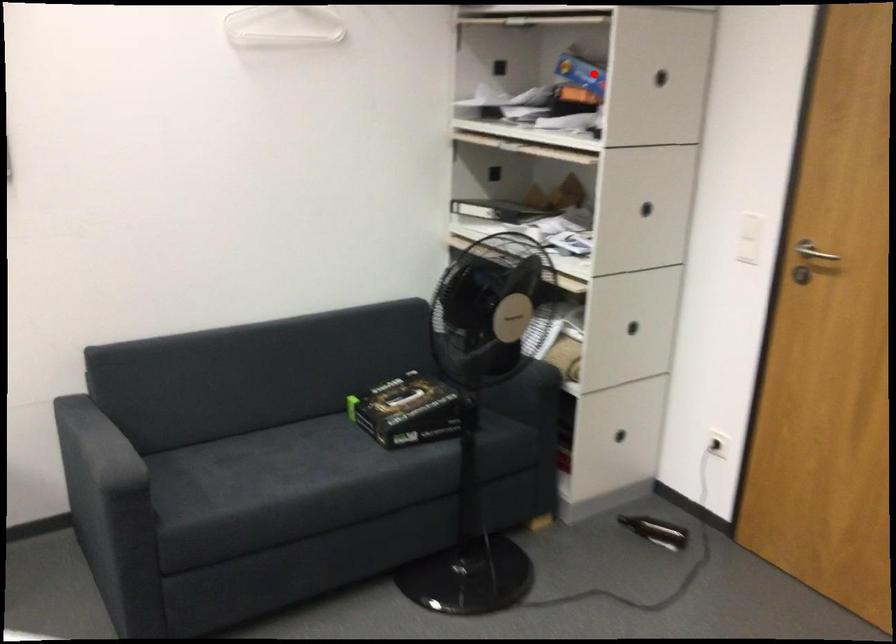
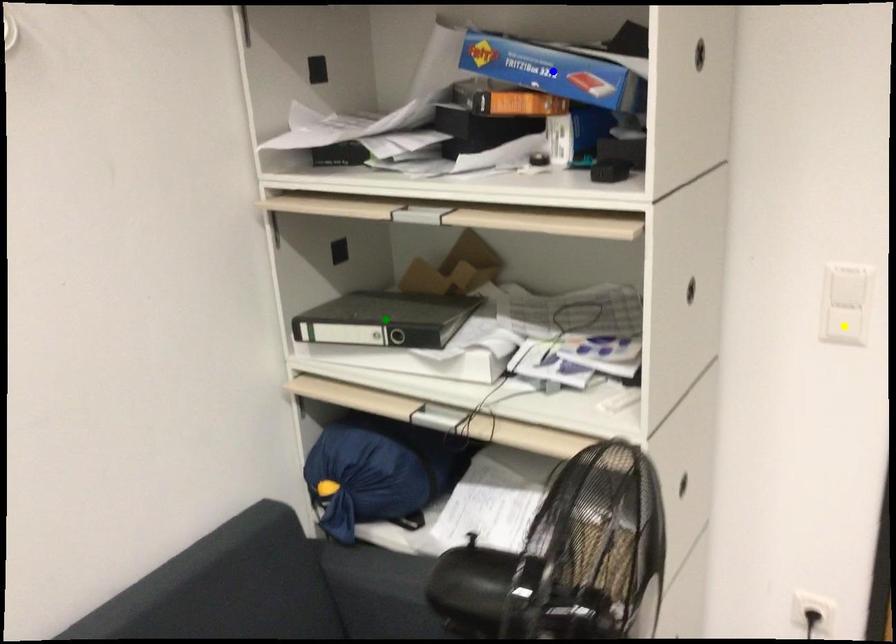
Question: I am providing you with two images of the same scene from different viewpoints. A red point is marked on the first image. You are given multiple points on the second image. Which mark in image 2 goes with the point in image 1?

Choices:
 (A) green point
 (B) blue point
 (C) yellow point

Answer: (B)